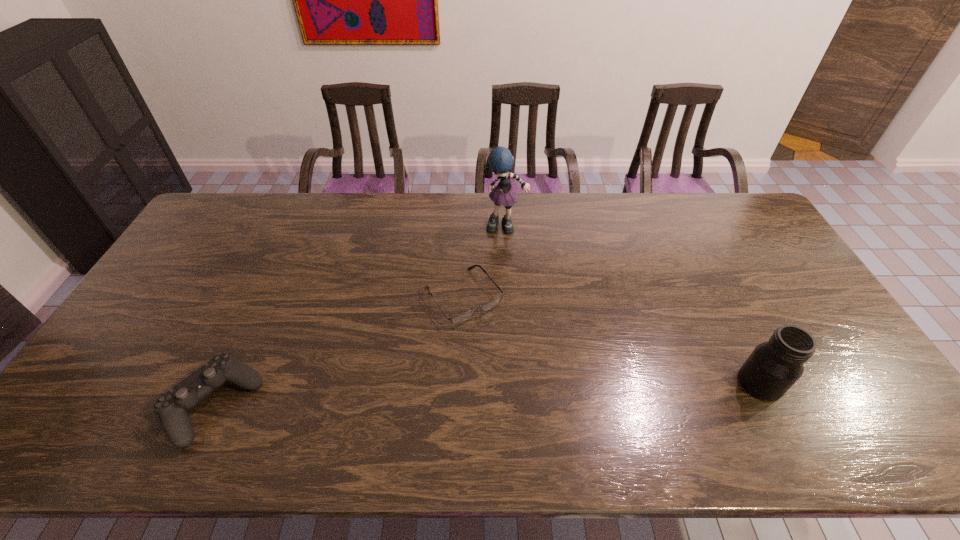
Where is `vacant point located between the third nearest object and the rag doll`? vacant point located between the third nearest object and the rag doll is located at coordinates (485, 262).

The image size is (960, 540). I want to click on unoccupied position between the shortest object and the leftmost object, so click(339, 350).

Locate an element on the screen. vacant region between the second farthest object and the rightmost object is located at coordinates (612, 340).

Identify which object is the nearest to the tallest object. Please provide its 2D coordinates. Your answer should be formatted as a tuple, i.e. [(x, y)], where the tuple contains the x and y coordinates of a point satisfying the conditions above.

[(462, 317)]

Where is `object that ranks as the third closest to the third tallest object`? This screenshot has width=960, height=540. object that ranks as the third closest to the third tallest object is located at coordinates (774, 366).

Where is `free spot that satisfies the following two spatial constraints: 1. on the back side of the tallest object; 2. on the right side of the third tallest object`? The image size is (960, 540). free spot that satisfies the following two spatial constraints: 1. on the back side of the tallest object; 2. on the right side of the third tallest object is located at coordinates [294, 227].

Locate an element on the screen. Image resolution: width=960 pixels, height=540 pixels. vacant region that satisfies the following two spatial constraints: 1. on the front side of the rightmost object; 2. on the left side of the tallest object is located at coordinates (516, 383).

The width and height of the screenshot is (960, 540). Find the location of `vacant area in the image that satisfies the following two spatial constraints: 1. on the back side of the shortest object; 2. on the right side of the control`. vacant area in the image that satisfies the following two spatial constraints: 1. on the back side of the shortest object; 2. on the right side of the control is located at coordinates (262, 296).

At what (x,y) coordinates should I click in order to perform the action: click on blank area in the image that satisfies the following two spatial constraints: 1. on the back side of the jar; 2. on the left side of the second shortest object. Please return your answer as a coordinate pair (x, y). The image size is (960, 540). Looking at the image, I should click on (223, 383).